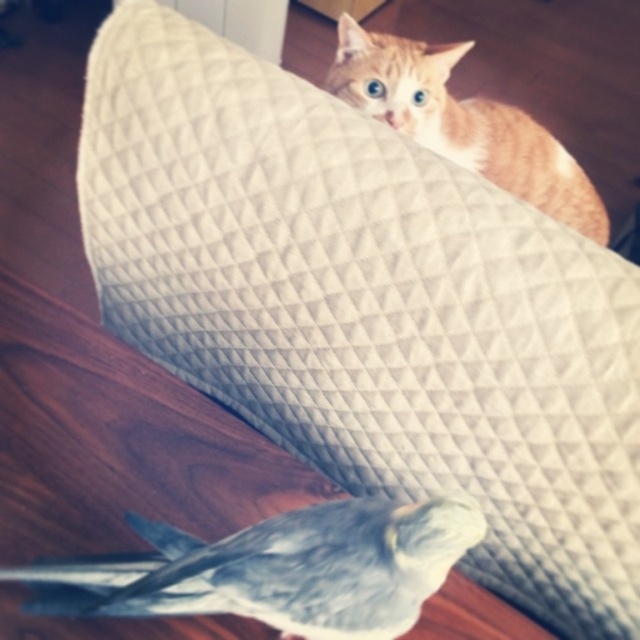
Is gray matte bird at lower left below orange fur cat at upper right?

Correct, gray matte bird at lower left is located below orange fur cat at upper right.

The width and height of the screenshot is (640, 640). I want to click on gray matte bird at lower left, so (x=280, y=568).

The height and width of the screenshot is (640, 640). Find the location of `gray matte bird at lower left`. gray matte bird at lower left is located at coordinates (280, 568).